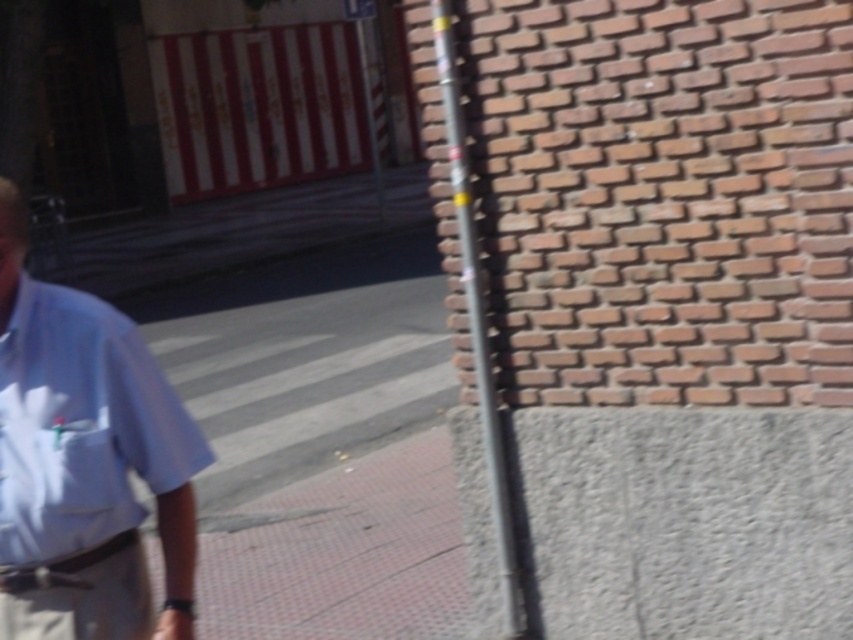
Can you confirm if white fabric pocket at lower left is positioned below metallic reflective sign at upper center?

Yes.

Does white fabric pocket at lower left have a lesser height compared to metallic reflective sign at upper center?

Correct, white fabric pocket at lower left is not as tall as metallic reflective sign at upper center.

Who is more forward, (51,456) or (347,1)?

Point (51,456)

This screenshot has height=640, width=853. Find the location of `white fabric pocket at lower left`. white fabric pocket at lower left is located at coordinates (78, 467).

Does light blue shirt at center come behind metallic reflective sign at upper center?

That is False.

Is point (30, 356) positioned in front of point (364, 8)?

That is True.

Is point (155, 632) positioned behind point (355, 6)?

No.

Image resolution: width=853 pixels, height=640 pixels. I want to click on light blue shirt at center, so click(x=85, y=460).

Is light blue shirt at center shorter than metallic silver pole at center?

Correct, light blue shirt at center is not as tall as metallic silver pole at center.

Is point (27, 317) positioned before point (506, 497)?

Yes, it is in front of point (506, 497).

You are a GUI agent. You are given a task and a screenshot of the screen. Output one action in this format:
    pyautogui.click(x=<x>, y=<y>)
    Task: Click on the light blue shirt at center
    This screenshot has width=853, height=640.
    Given the screenshot: What is the action you would take?
    pyautogui.click(x=85, y=460)